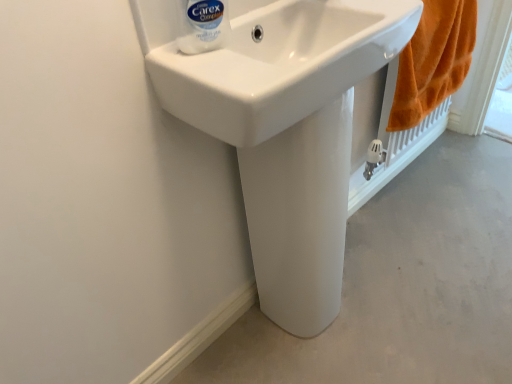
Question: Can you confirm if white smooth pedestal at center is positioned to the left of white plastic bottle at upper center?

Choices:
 (A) yes
 (B) no

Answer: (B)

Question: From a real-world perspective, is white smooth pedestal at center beneath white plastic bottle at upper center?

Choices:
 (A) yes
 (B) no

Answer: (A)

Question: Considering the relative sizes of white smooth pedestal at center and white plastic bottle at upper center in the image provided, is white smooth pedestal at center bigger than white plastic bottle at upper center?

Choices:
 (A) no
 (B) yes

Answer: (B)

Question: Would you say white smooth pedestal at center is outside white plastic bottle at upper center?

Choices:
 (A) no
 (B) yes

Answer: (B)

Question: Can you confirm if white smooth pedestal at center is thinner than white plastic bottle at upper center?

Choices:
 (A) yes
 (B) no

Answer: (B)

Question: Does white smooth pedestal at center have a lesser height compared to white plastic bottle at upper center?

Choices:
 (A) yes
 (B) no

Answer: (A)

Question: Is white glossy sink at center closer to camera compared to white glossy pedestal at center?

Choices:
 (A) no
 (B) yes

Answer: (B)

Question: Is white glossy sink at center in contact with white glossy pedestal at center?

Choices:
 (A) no
 (B) yes

Answer: (A)

Question: From the image's perspective, does white glossy sink at center appear higher than white glossy pedestal at center?

Choices:
 (A) yes
 (B) no

Answer: (A)

Question: Is white glossy sink at center smaller than white glossy pedestal at center?

Choices:
 (A) yes
 (B) no

Answer: (A)

Question: Could you tell me if white glossy sink at center is facing white glossy pedestal at center?

Choices:
 (A) no
 (B) yes

Answer: (A)

Question: Would you say white glossy pedestal at center is part of white glossy sink at center's contents?

Choices:
 (A) no
 (B) yes

Answer: (A)

Question: Could you tell me if orange fluffy towel at right is turned towards white smooth pedestal at center?

Choices:
 (A) yes
 (B) no

Answer: (B)